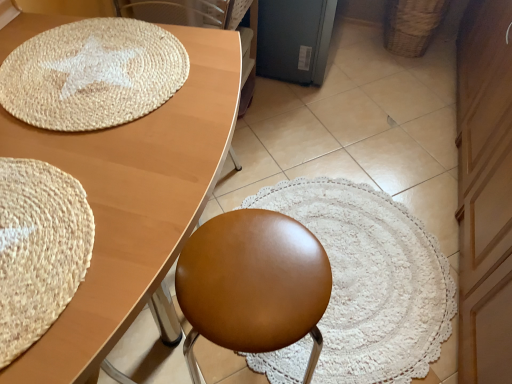
Locate an element on the screen. This screenshot has width=512, height=384. vacant region above satin brown stool at center (from a real-world perspective) is located at coordinates (256, 268).